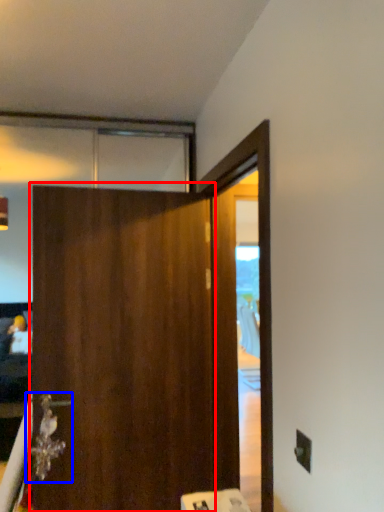
Question: Which point is closer to the camera, barn door (highlighted by a red box) or door handle (highlighted by a blue box)?

Choices:
 (A) barn door
 (B) door handle

Answer: (A)